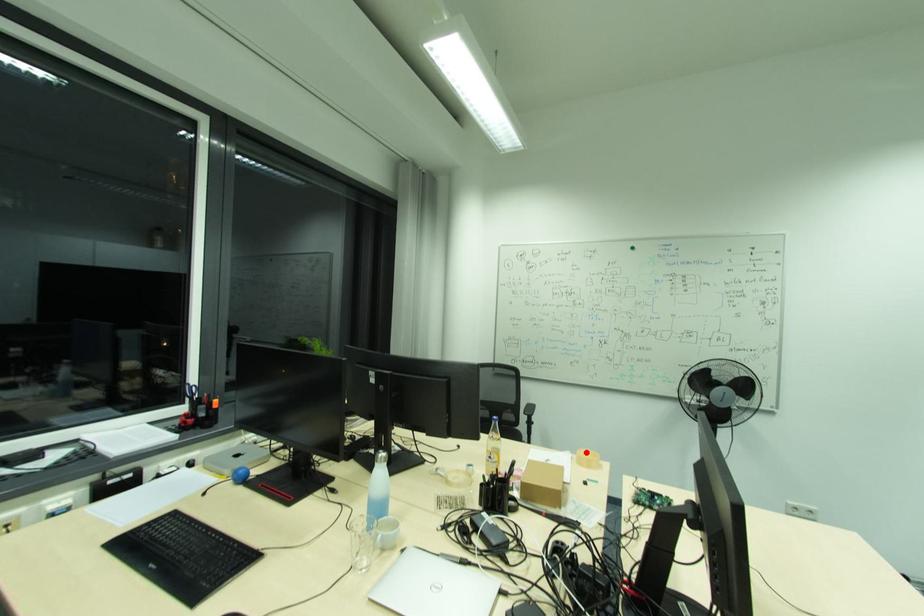
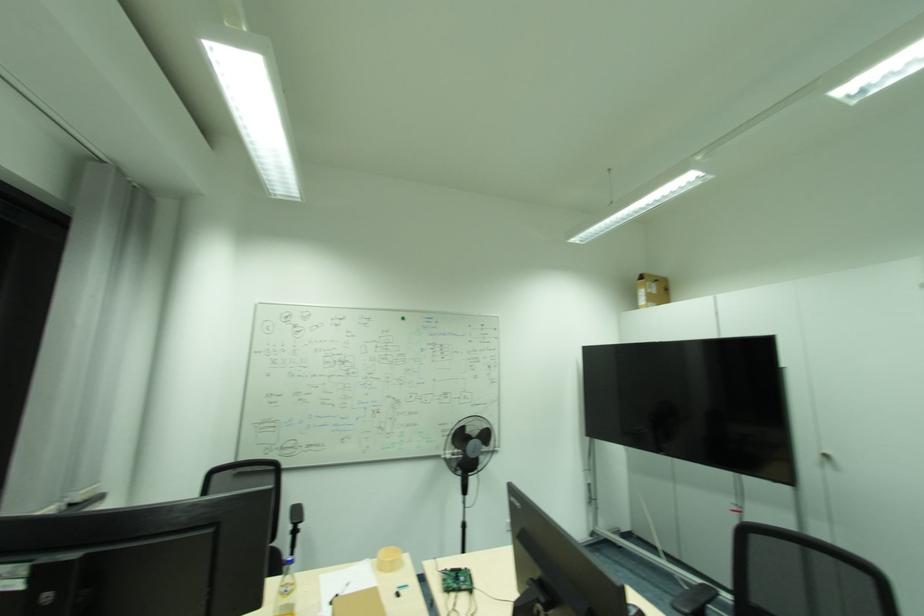
In the second image, find the point that corresponds to the highlighted location in the first image.

(386, 553)